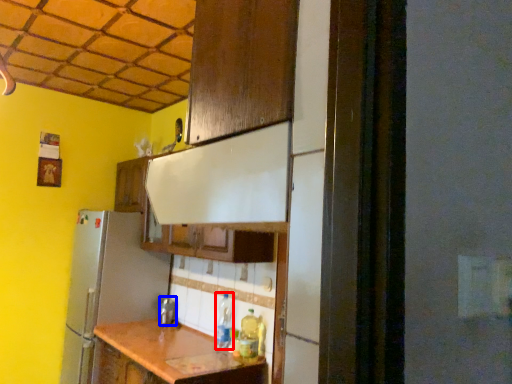
Question: Which object appears closest to the camera in this image, bottle (highlighted by a red box) or silver (highlighted by a blue box)?

Choices:
 (A) bottle
 (B) silver

Answer: (A)